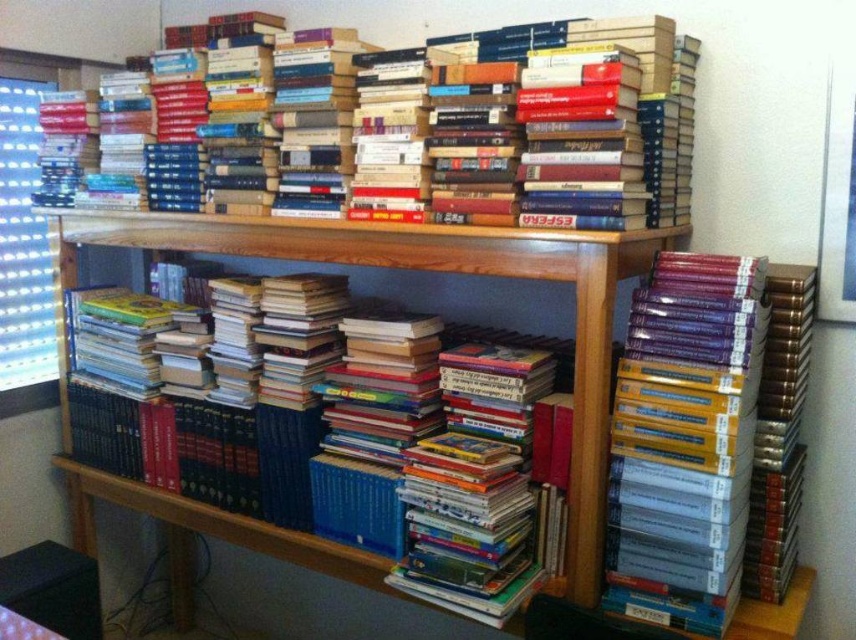
Looking at this image, you are a librarian trying to place a new book on the shelf. The new book is 10 cm taller than the hardcover books at upper center. Will it fit in height on the wooden bookshelf at center?

The hardcover books at upper center is not as tall as wooden bookshelf at center, so the new book, being 10 cm taller than the hardcover books at upper center, may still fit on the wooden bookshelf at center if there is enough vertical space remaining.

You are standing at point (459, 189) and want to reach the bottom shelf of the wooden shelving unit. The distance between you and the bottom shelf is 5.27 feet. If your arm can reach 2 feet, can you grab an item from the bottom shelf without moving closer?

The distance between you and the bottom shelf is 5.27 feet, which is greater than your arm reach of 2 feet. Therefore, you cannot grab an item from the bottom shelf without moving closer.

You are standing in front of the wooden bookshelf at center and want to reach the hardcover books at upper center. Which direction should you move to get closer to them?

The hardcover books at upper center are further to the viewer than the wooden bookshelf at center, so you should move forward towards the wooden bookshelf at center to get closer to them.